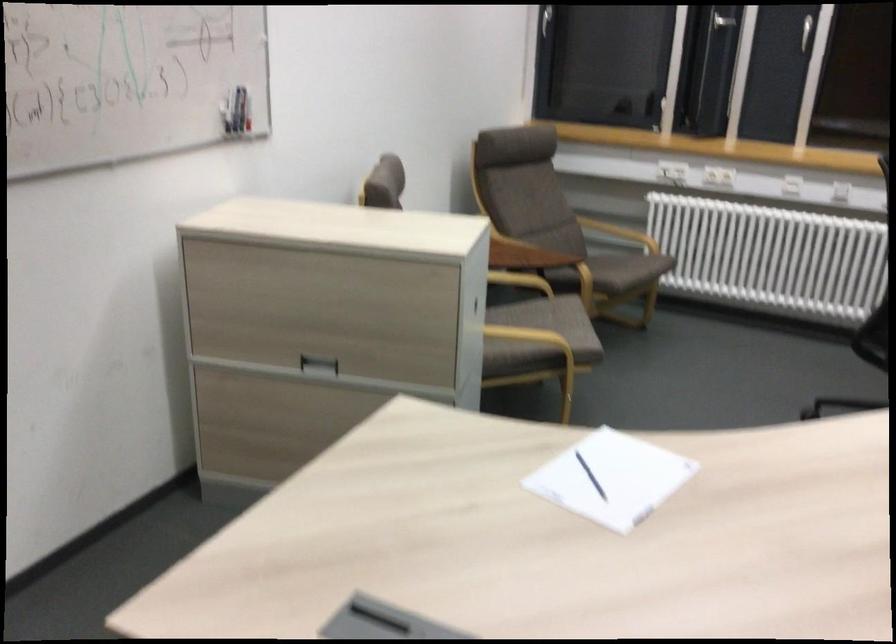
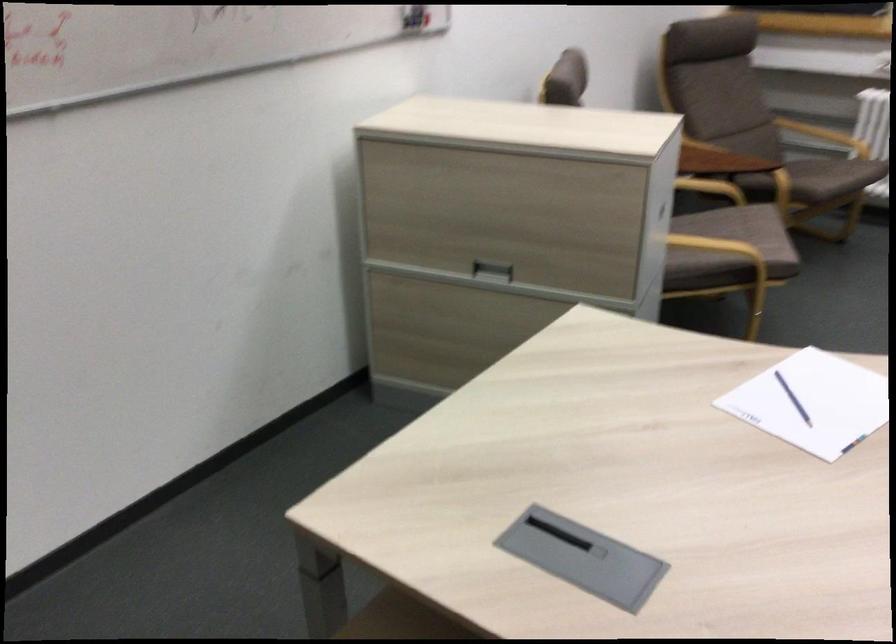
Where in the second image is the point corresponding to (317,365) from the first image?

(492, 270)